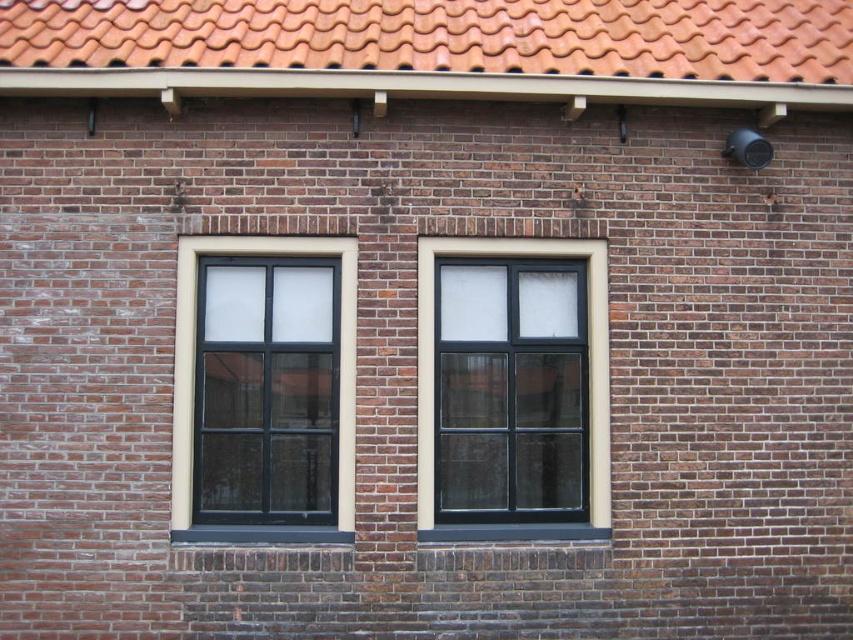
Which is above, black glass window at center or black matte window at left?

Positioned higher is black matte window at left.

Does black glass window at center have a lesser width compared to black matte window at left?

In fact, black glass window at center might be wider than black matte window at left.

Is point (421, 371) positioned in front of point (184, 236)?

That is True.

Locate an element on the screen. The image size is (853, 640). black glass window at center is located at coordinates click(587, 344).

Is terracotta clay tiles at top closer to camera compared to black glass window at center?

Yes, terracotta clay tiles at top is in front of black glass window at center.

Does point (105, 54) lie in front of point (515, 252)?

Yes, point (105, 54) is in front of point (515, 252).

Image resolution: width=853 pixels, height=640 pixels. I want to click on terracotta clay tiles at top, so coord(444,35).

Does point (792, 61) come in front of point (314, 248)?

No.

Is terracotta clay tiles at top thinner than black matte window at left?

No, terracotta clay tiles at top is not thinner than black matte window at left.

Which is in front, point (427, 20) or point (190, 525)?

Positioned in front is point (190, 525).

This screenshot has height=640, width=853. Find the location of `terracotta clay tiles at top`. terracotta clay tiles at top is located at coordinates (444, 35).